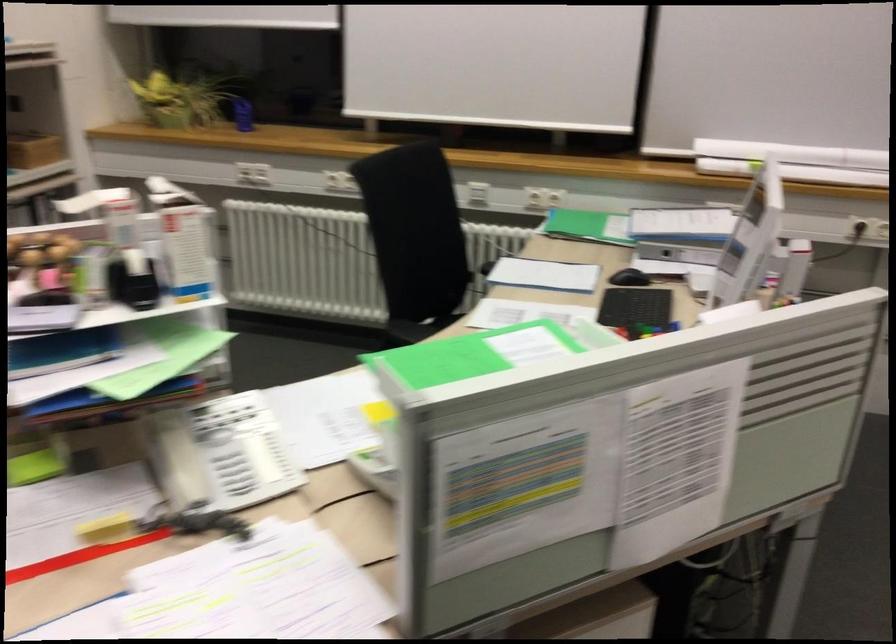
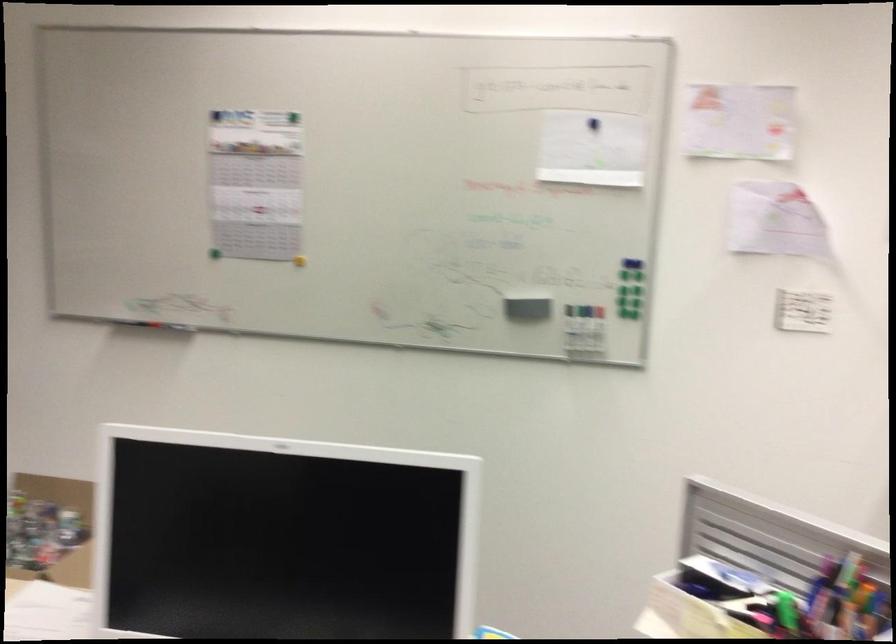
Question: The camera is either moving clockwise (left) or counter-clockwise (right) around the object. The first image is from the beginning of the video and the second image is from the end. Is the camera moving left or right when shooting the video?

Choices:
 (A) Left
 (B) Right

Answer: (B)